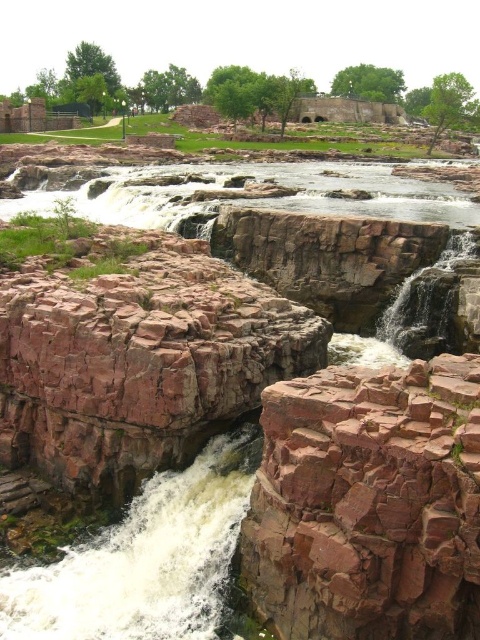
You are a hiker standing at the edge of the brown rock waterfall at lower left. You want to take a photo of the waterfall from a safe distance. Considering the waterfall is 25.94 meters away from you, is this distance sufficient to avoid getting wet from the spray?

The brown rock waterfall at lower left is 25.94 meters away from the viewer. This distance should be sufficient to avoid getting wet from the spray, as water spray typically doesn not travel that far from the waterfall.

You are a hiker standing on the path near the rusty stone bridge at center and the white frothy water at center. Which object is closer to you?

The rusty stone bridge at center is closer to you because it is in front of the white frothy water at center.

You are a hiker standing at the edge of the brown rock waterfall at lower left and want to cross to the white frothy water at center. Is there a clear path between them?

The brown rock waterfall at lower left is in front of white frothy water at center, so there is no clear path between them. The waterfall blocks the direct route.